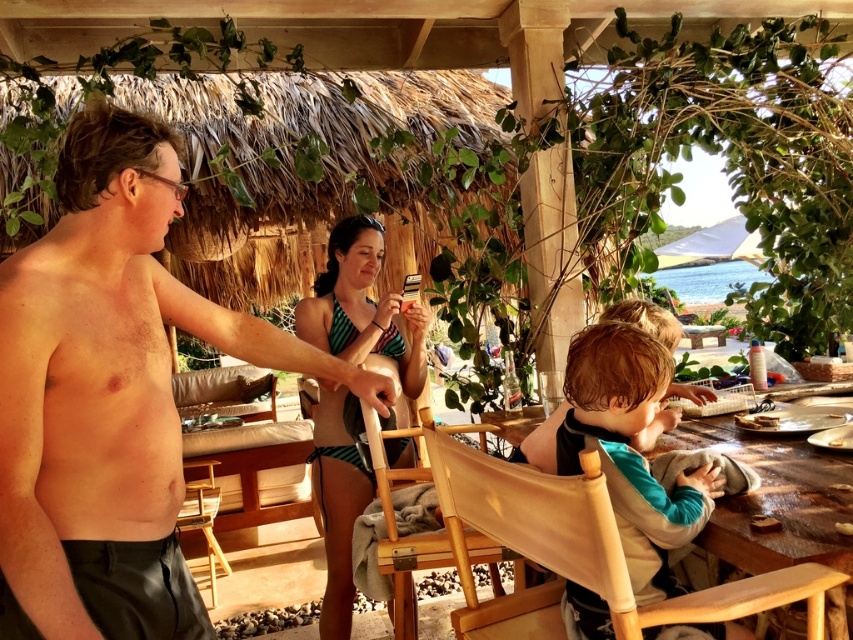
Question: Which object is the farthest from the shiny skin man at left?

Choices:
 (A) light brown wood chair at lower right
 (B) green striped swimsuit at center
 (C) wooden table at lower right
 (D) wooden chair at lower left

Answer: (D)

Question: Does wooden table at lower right appear over wooden chair at center?

Choices:
 (A) yes
 (B) no

Answer: (A)

Question: Which point appears closest to the camera in this image?

Choices:
 (A) [339, 451]
 (B) [659, 372]

Answer: (B)

Question: Which object appears farthest from the camera in this image?

Choices:
 (A) wooden table at lower right
 (B) green striped swimsuit at center

Answer: (B)

Question: Does green striped swimsuit at center appear over wooden chair at center?

Choices:
 (A) no
 (B) yes

Answer: (B)

Question: Can you confirm if light brown wood chair at lower right is smaller than light brown fabric chair at lower right?

Choices:
 (A) no
 (B) yes

Answer: (A)